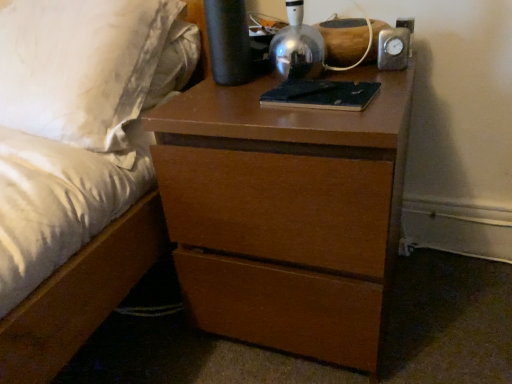
Question: Should I look upward or downward to see metallic dome at upper center?

Choices:
 (A) down
 (B) up

Answer: (B)

Question: From the image's perspective, is matte brown bed at center on brown wood chest of drawers at center?

Choices:
 (A) no
 (B) yes

Answer: (B)

Question: Would you say matte brown bed at center contains brown wood chest of drawers at center?

Choices:
 (A) no
 (B) yes

Answer: (A)

Question: Are matte brown bed at center and brown wood chest of drawers at center beside each other?

Choices:
 (A) yes
 (B) no

Answer: (B)

Question: Considering the relative sizes of matte brown bed at center and brown wood chest of drawers at center in the image provided, is matte brown bed at center thinner than brown wood chest of drawers at center?

Choices:
 (A) no
 (B) yes

Answer: (B)

Question: Would you say matte brown bed at center is outside brown wood chest of drawers at center?

Choices:
 (A) no
 (B) yes

Answer: (B)

Question: Is matte brown bed at center taller than brown wood chest of drawers at center?

Choices:
 (A) no
 (B) yes

Answer: (B)

Question: From a real-world perspective, is dark blue leather book at center positioned over matte brown bed at center based on gravity?

Choices:
 (A) yes
 (B) no

Answer: (A)

Question: Is dark blue leather book at center facing towards matte brown bed at center?

Choices:
 (A) no
 (B) yes

Answer: (A)

Question: Can you confirm if dark blue leather book at center is wider than matte brown bed at center?

Choices:
 (A) yes
 (B) no

Answer: (B)

Question: Would you say dark blue leather book at center is a long distance from matte brown bed at center?

Choices:
 (A) yes
 (B) no

Answer: (B)

Question: Is dark blue leather book at center taller than matte brown bed at center?

Choices:
 (A) yes
 (B) no

Answer: (B)

Question: Is dark blue leather book at center bigger than matte brown bed at center?

Choices:
 (A) no
 (B) yes

Answer: (A)

Question: Is matte brown bed at center directly adjacent to dark blue leather book at center?

Choices:
 (A) yes
 (B) no

Answer: (B)